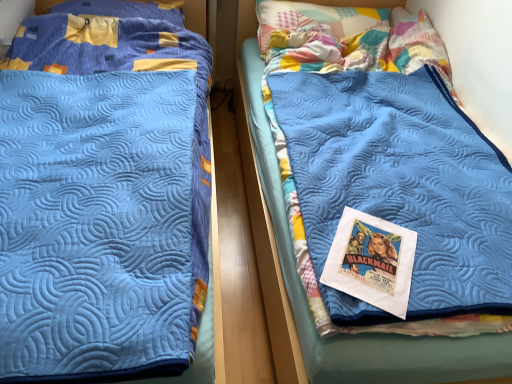
Question: In the image, is blue quilted blanket at left, acting as the second bed starting from the right, positioned in front of or behind matte paper poster at center?

Choices:
 (A) behind
 (B) front

Answer: (B)

Question: In terms of height, does blue quilted blanket at left, acting as the second bed starting from the right, look taller or shorter compared to matte paper poster at center?

Choices:
 (A) short
 (B) tall

Answer: (B)

Question: Estimate the real-world distances between objects in this image. Which object is farther from the matte paper poster at center?

Choices:
 (A) blue quilted blanket at center, which ranks as the 1th bed in right-to-left order
 (B) blue quilted blanket at left, acting as the second bed starting from the right
 (C) yellow fabric pillow at upper left, which ranks as the 1th pillow in left-to-right order
 (D) patchwork fabric pillow at upper center, the 2th pillow when ordered from left to right

Answer: (C)

Question: Which object is positioned farthest from the patchwork fabric pillow at upper center, the 2th pillow when ordered from left to right?

Choices:
 (A) blue quilted blanket at left, acting as the second bed starting from the right
 (B) matte paper poster at center
 (C) blue quilted blanket at center, the second bed positioned from the left
 (D) yellow fabric pillow at upper left, which is the second pillow from right to left

Answer: (B)